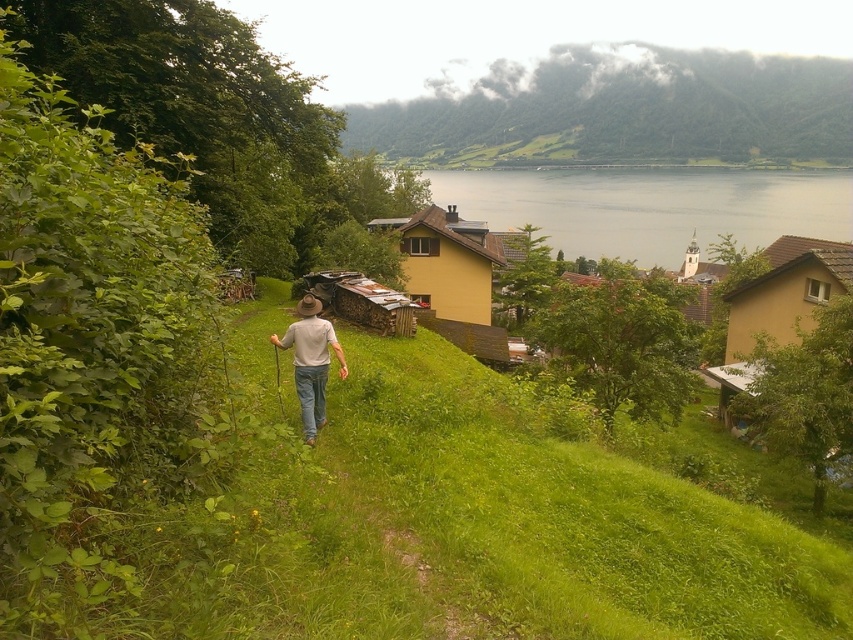
Question: Which point is farther from the camera taking this photo?

Choices:
 (A) (726, 333)
 (B) (648, 237)

Answer: (B)

Question: Which point is closer to the camera?

Choices:
 (A) yellow matte house at center
 (B) yellow matte house at right

Answer: (B)

Question: Is green grassy hillside at upper center in front of yellow matte house at right?

Choices:
 (A) yes
 (B) no

Answer: (B)

Question: Does green grassy hillside at center appear on the right side of green grassy hillside at upper center?

Choices:
 (A) no
 (B) yes

Answer: (A)

Question: Which point appears closest to the camera in this image?

Choices:
 (A) (836, 74)
 (B) (833, 260)

Answer: (B)

Question: Does grayish water at upper center appear under yellow matte house at center?

Choices:
 (A) yes
 (B) no

Answer: (B)